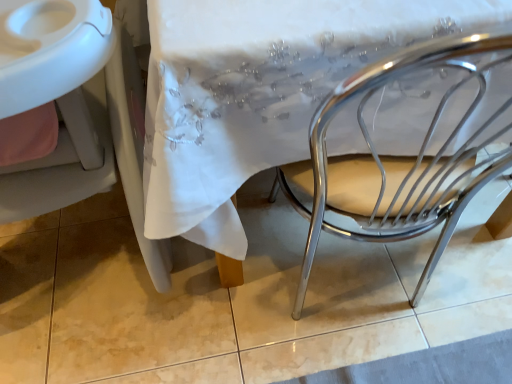
This screenshot has width=512, height=384. Describe the element at coordinates (400, 161) in the screenshot. I see `shiny metallic chair at center` at that location.

Find the location of `shiny metallic chair at center`. shiny metallic chair at center is located at coordinates (400, 161).

In order to click on shiny metallic chair at center in this screenshot , I will do `click(400, 161)`.